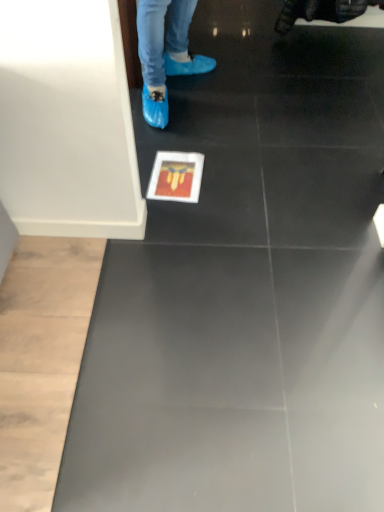
Image resolution: width=384 pixels, height=512 pixels. I want to click on vacant area on top of black smooth concrete at center (from a real-world perspective), so click(203, 355).